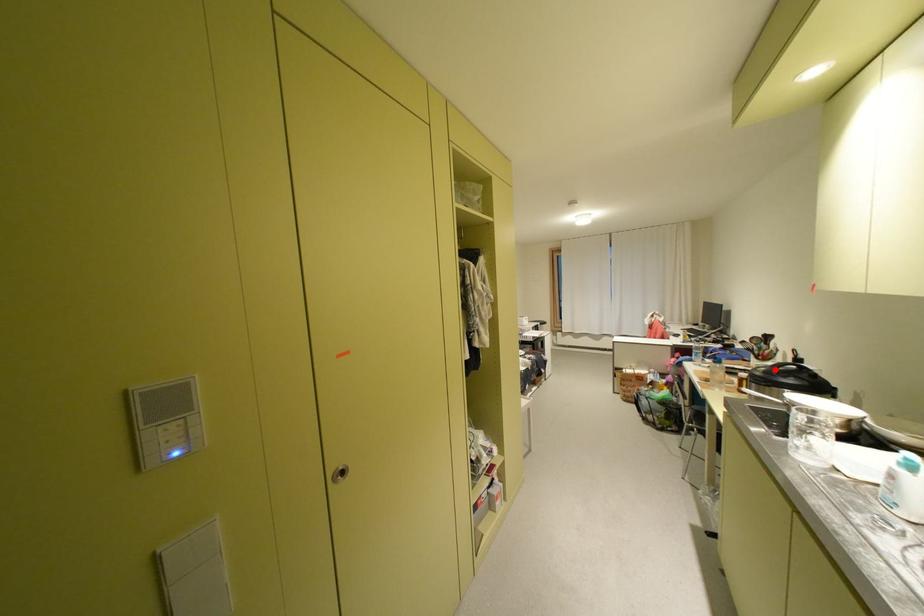
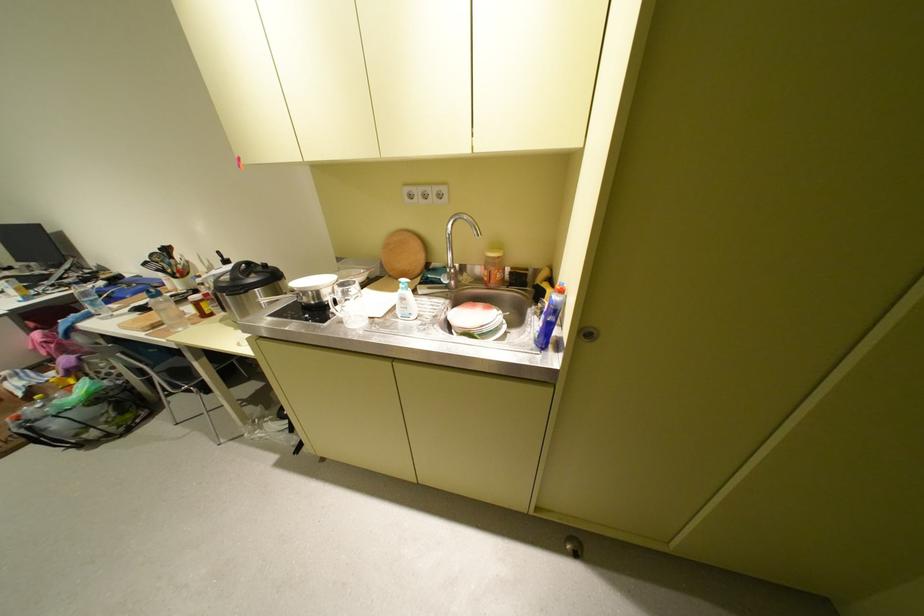
Question: I am providing you with two images of the same scene from different viewpoints. A red point is marked on the first image. At the location where the point appears in image 1, is it still visible in image 2?

Choices:
 (A) Yes
 (B) No

Answer: (A)